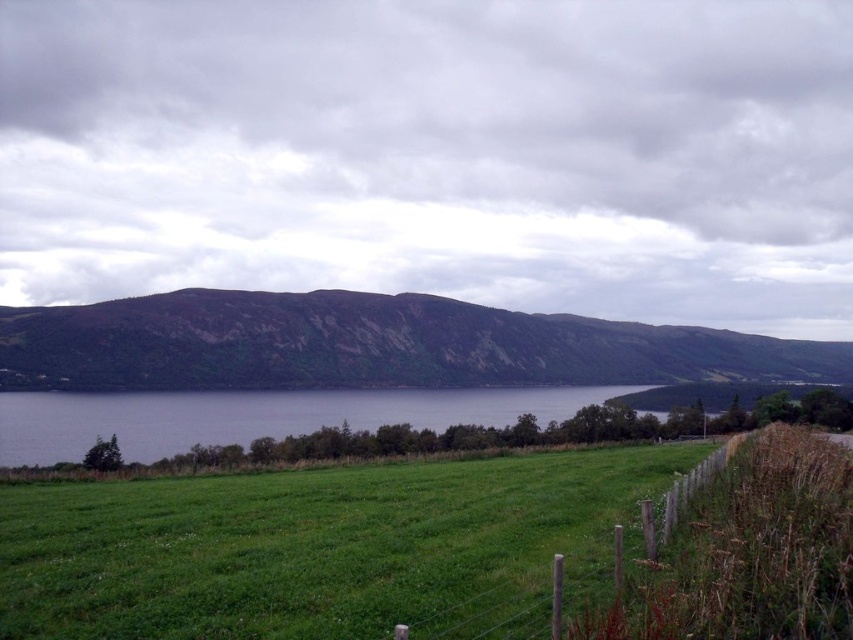
Does brown rocky mountain at center come behind wooden post fence at lower right?

Yes, brown rocky mountain at center is further from the viewer.

Between brown rocky mountain at center and wooden post fence at lower right, which one appears on the right side from the viewer's perspective?

From the viewer's perspective, brown rocky mountain at center appears more on the right side.

Which is behind, point (593, 326) or point (567, 602)?

The point (593, 326) is more distant.

Where is `brown rocky mountain at center`? Image resolution: width=853 pixels, height=640 pixels. brown rocky mountain at center is located at coordinates (373, 346).

Which is more to the left, green grassy field at center or wooden post fence at lower right?

green grassy field at center

Can you confirm if green grassy field at center is wider than wooden post fence at lower right?

Yes.

The width and height of the screenshot is (853, 640). I want to click on green grassy field at center, so click(323, 548).

Can you confirm if green grassy field at center is thinner than green grassy field at lower center?

Correct, green grassy field at center's width is less than green grassy field at lower center's.

Is point (233, 534) more distant than point (355, 420)?

That is False.

What do you see at coordinates (323, 548) in the screenshot? I see `green grassy field at center` at bounding box center [323, 548].

Locate an element on the screen. The height and width of the screenshot is (640, 853). green grassy field at center is located at coordinates (323, 548).